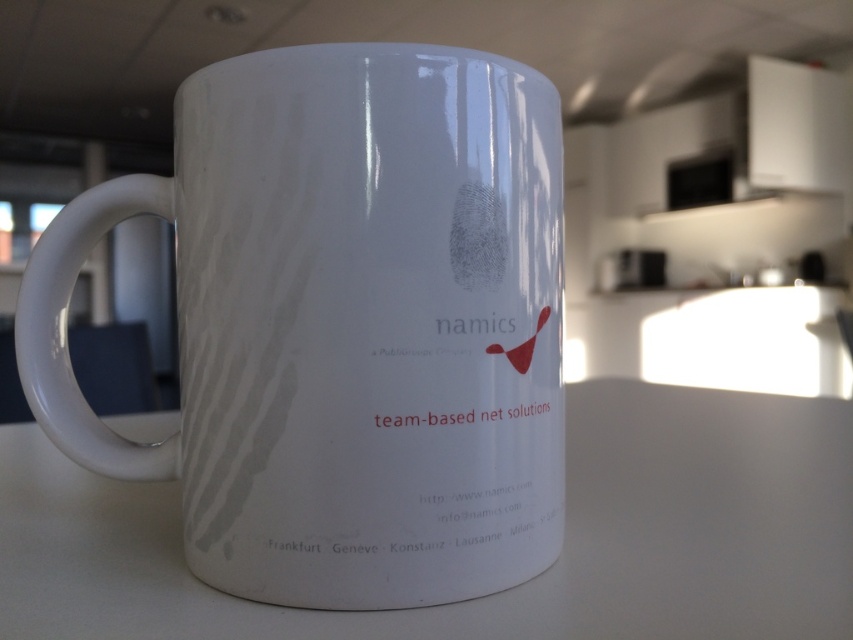
Does glossy ceramic mug at center have a lesser height compared to white matte counter top at center?

No, glossy ceramic mug at center is not shorter than white matte counter top at center.

Is glossy ceramic mug at center thinner than white matte counter top at center?

Correct, glossy ceramic mug at center's width is less than white matte counter top at center's.

Is point (329, 272) in front of point (773, 540)?

Yes, it is.

You are a GUI agent. You are given a task and a screenshot of the screen. Output one action in this format:
    pyautogui.click(x=<x>, y=<y>)
    Task: Click on the glossy ceramic mug at center
    
    Given the screenshot: What is the action you would take?
    pyautogui.click(x=344, y=324)